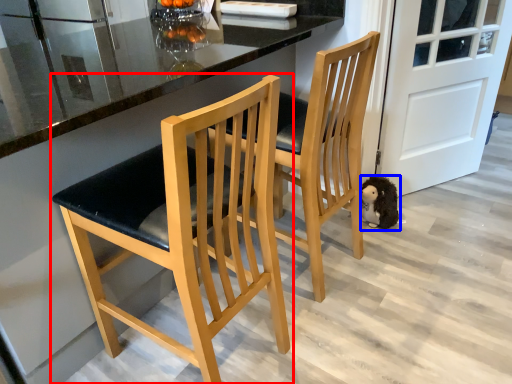
Question: Which object is further to the camera taking this photo, chair (highlighted by a red box) or animal (highlighted by a blue box)?

Choices:
 (A) chair
 (B) animal

Answer: (B)